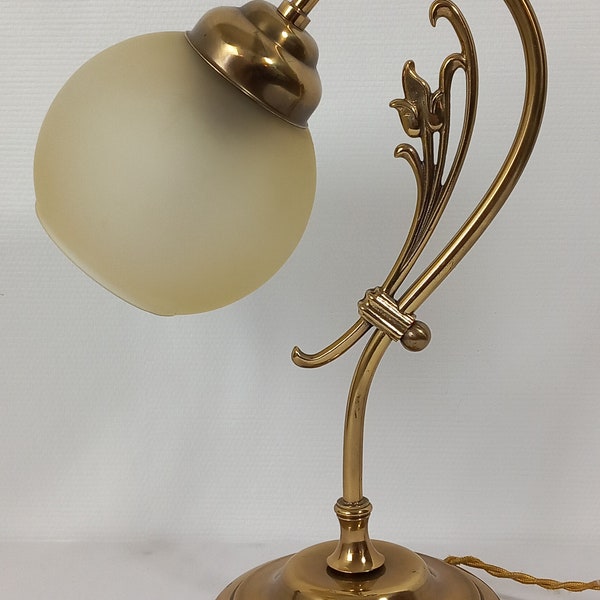
Where is `electric cord`? The width and height of the screenshot is (600, 600). electric cord is located at coordinates (554, 576).